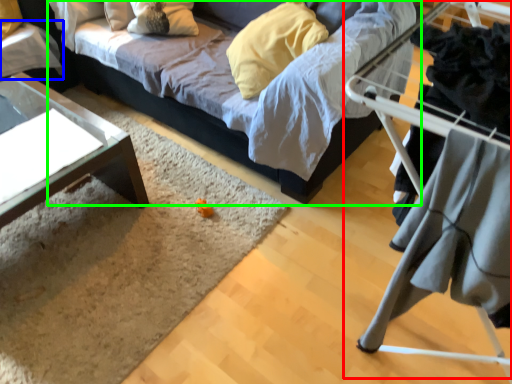
Question: Estimate the real-world distances between objects in this image. Which object is farther from bunk bed (highlighted by a red box), table (highlighted by a blue box) or studio couch (highlighted by a green box)?

Choices:
 (A) table
 (B) studio couch

Answer: (A)